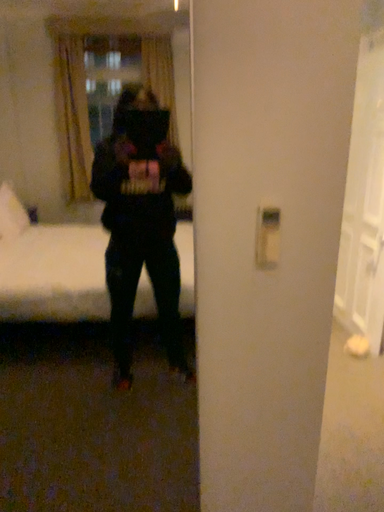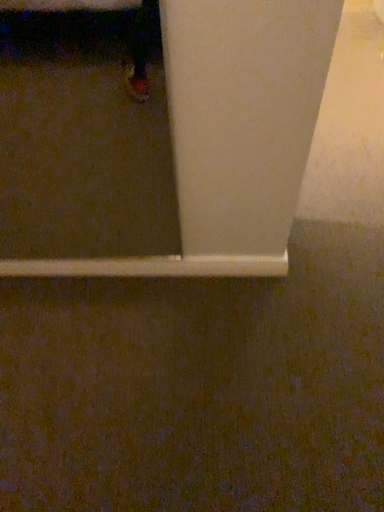
Question: How did the camera likely rotate when shooting the video?

Choices:
 (A) rotated upward
 (B) rotated downward

Answer: (B)